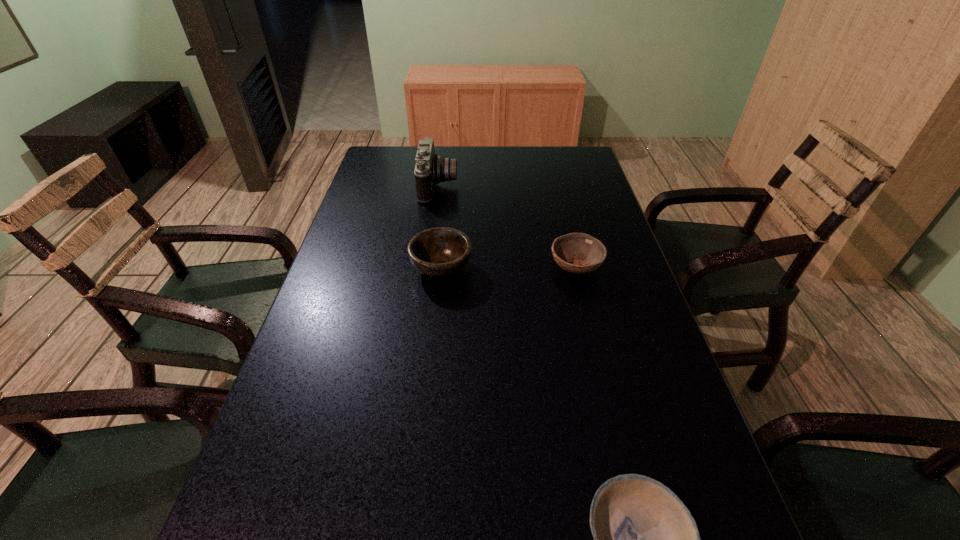
The width and height of the screenshot is (960, 540). I want to click on vacant space at the far left corner, so click(392, 167).

Identify which object is located as the third nearest to the nearest bowl. Please provide its 2D coordinates. Your answer should be formatted as a tuple, i.e. [(x, y)], where the tuple contains the x and y coordinates of a point satisfying the conditions above.

[(430, 168)]

I want to click on object identified as the third closest to the nearest bowl, so click(x=430, y=168).

Identify the location of bowl that can be found as the second closest to the leftmost bowl. The image size is (960, 540). (645, 539).

The width and height of the screenshot is (960, 540). In order to click on the closest bowl to the nearest object in this screenshot , I will do `click(587, 253)`.

This screenshot has width=960, height=540. I want to click on free spot that satisfies the following two spatial constraints: 1. on the front-facing side of the camera; 2. on the left side of the leftmost bowl, so click(x=427, y=268).

You are a GUI agent. You are given a task and a screenshot of the screen. Output one action in this format:
    pyautogui.click(x=<x>, y=<y>)
    Task: Click on the blank space that satisfies the following two spatial constraints: 1. on the front-facing side of the farthest object; 2. on the right side of the leftmost bowl
    
    Given the screenshot: What is the action you would take?
    pyautogui.click(x=427, y=268)

Find the location of a particular element. Image resolution: width=960 pixels, height=540 pixels. vacant space that satisfies the following two spatial constraints: 1. on the front-facing side of the leftmost bowl; 2. on the right side of the farthest object is located at coordinates (427, 268).